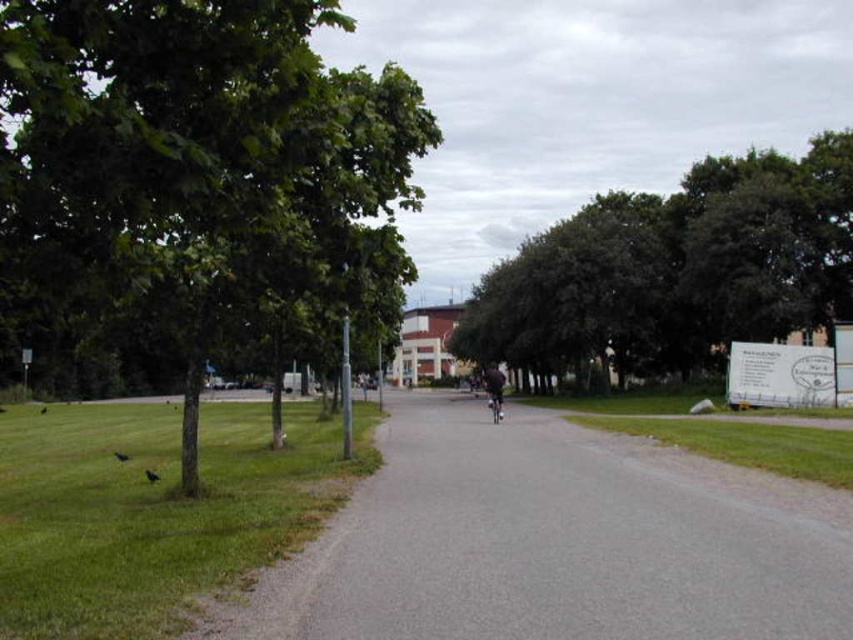
Locate an element on the screen. The image size is (853, 640). green leafy tree at left is located at coordinates coord(196,180).

Can you confirm if green leafy tree at left is shorter than dark fabric bicycle at center?

No, green leafy tree at left is not shorter than dark fabric bicycle at center.

This screenshot has height=640, width=853. I want to click on green leafy tree at left, so click(x=196, y=180).

Can you confirm if gray asphalt path at center is positioned above dark fabric bicycle at center?

Incorrect, gray asphalt path at center is not positioned above dark fabric bicycle at center.

Is point (509, 560) positioned in front of point (500, 374)?

Yes, point (509, 560) is in front of point (500, 374).

Is point (685, 474) farther from viewer compared to point (502, 396)?

No.

Image resolution: width=853 pixels, height=640 pixels. What are the coordinates of `gray asphalt path at center` in the screenshot? It's located at (554, 541).

Measure the distance between point (70,8) and camera.

A distance of 4.38 meters exists between point (70,8) and camera.

Is point (396, 145) positioned after point (498, 419)?

That is False.

Who is more distant from viewer, (56, 134) or (491, 394)?

Point (491, 394)

Find the location of `green leafy tree at left`. green leafy tree at left is located at coordinates (196, 180).